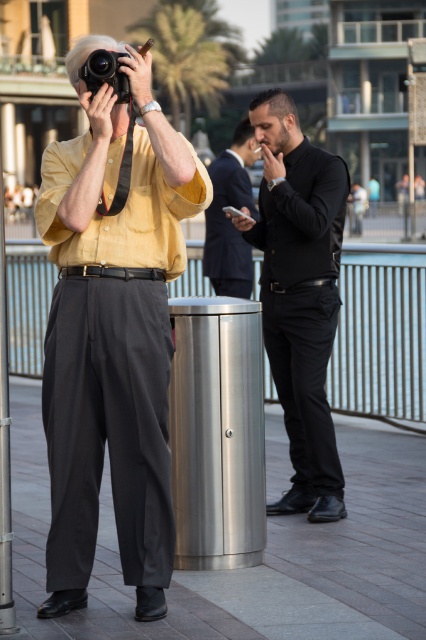
Question: Which of the following is the farthest from the observer?

Choices:
 (A) (101, 76)
 (B) (290, 406)

Answer: (B)

Question: Is matte yellow shirt at center above black matte shirt at center?

Choices:
 (A) no
 (B) yes

Answer: (A)

Question: Does black matte shirt at center lie in front of black suit at right?

Choices:
 (A) no
 (B) yes

Answer: (B)

Question: In this image, where is matte yellow shirt at center located relative to black suit at right?

Choices:
 (A) left
 (B) right

Answer: (A)

Question: Which of these objects is positioned closest to the matte yellow shirt at center?

Choices:
 (A) black suit at right
 (B) matte black camera at upper left
 (C) black matte shirt at center

Answer: (B)

Question: Which of the following is the closest to the observer?

Choices:
 (A) (108, 77)
 (B) (293, 412)

Answer: (A)